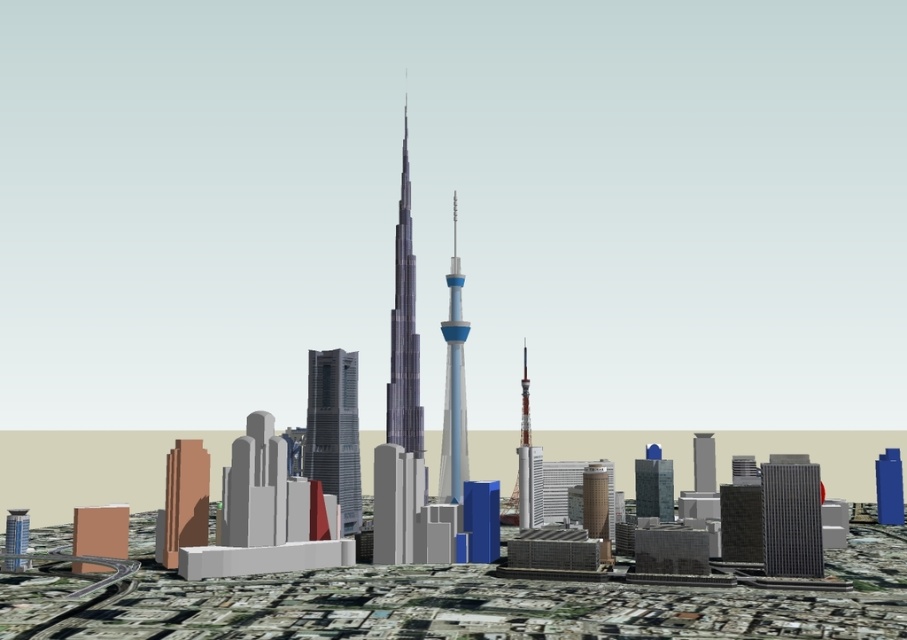
You are a city planner analyzing the layout of this digital cityscape. The shiny metallic skyscraper at center is part of a proposed development. Given its coordinates at point 0.675, 0.369, how does its position compare to the other buildings in the scene?

The shiny metallic skyscraper at center is positioned at coordinates (334, 432), which places it centrally within the urban landscape, likely serving as a focal point among the surrounding buildings.

You are an architect reviewing a city model. You notice two points in the foreground of the cityscape. The first point is at coordinates point (353, 400) and the second is at point (467, 333). Which of these two points is nearer to your viewpoint as you examine the model?

Point (353, 400) is closer to the camera than point (467, 333), so the first point is nearer to your viewpoint.

You are an urban planner reviewing this cityscape design. You need to determine if the shiny metallic skyscraper at center can accommodate a new wide pedestrian walkway between it and the shiny glass skyscraper at center. Based on the provided information, is there sufficient space for the walkway?

The shiny metallic skyscraper at center might be wider than shiny glass skyscraper at center, so there may not be enough space for the walkway. Further measurements are needed to confirm.